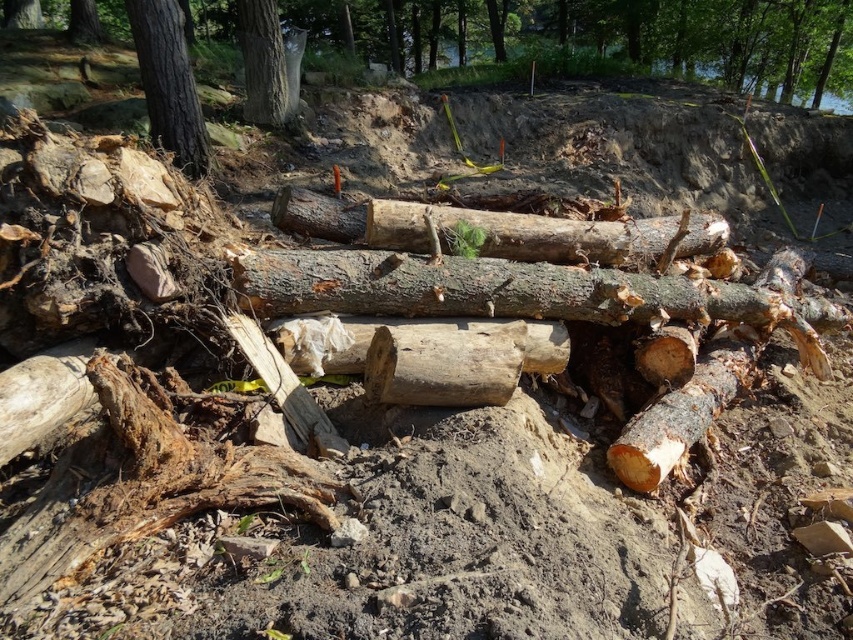
Question: Among these points, which one is nearest to the camera?

Choices:
 (A) (186, 67)
 (B) (421, 234)
 (C) (257, 12)

Answer: (B)

Question: Estimate the real-world distances between objects in this image. Which object is farther from the brown rough wood at center?

Choices:
 (A) smooth gray bark at upper left
 (B) smooth brown tree trunk at upper left

Answer: (A)

Question: Estimate the real-world distances between objects in this image. Which object is closer to the smooth gray bark at upper left?

Choices:
 (A) natural wood log at center
 (B) brown rough wood at center
 (C) smooth brown tree trunk at upper left

Answer: (C)

Question: Is natural wood log at center below smooth brown tree trunk at upper left?

Choices:
 (A) yes
 (B) no

Answer: (A)

Question: Is brown rough wood at center closer to the viewer compared to natural wood log at center?

Choices:
 (A) yes
 (B) no

Answer: (A)

Question: Can you confirm if brown rough wood at center is positioned below smooth gray bark at upper left?

Choices:
 (A) yes
 (B) no

Answer: (A)